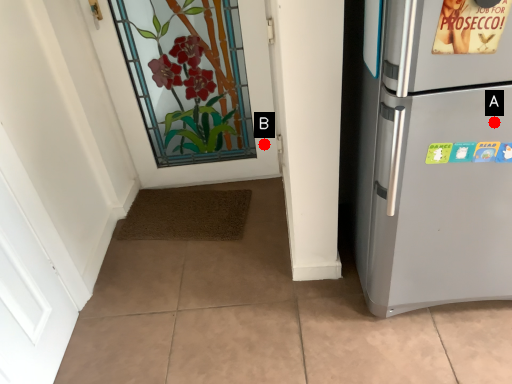
Question: Two points are circled on the image, labeled by A and B beside each circle. Which of the following is the closest to the observer?

Choices:
 (A) A is closer
 (B) B is closer

Answer: (A)